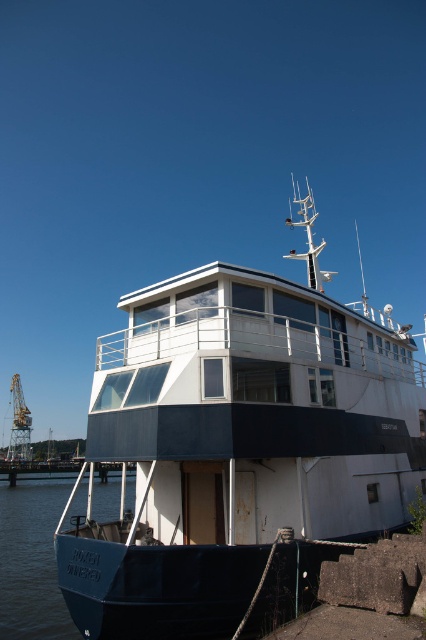
Question: Among these objects, which one is farthest from the camera?

Choices:
 (A) white matte cabin cruiser at center
 (B) teal rubber boat at lower left

Answer: (B)

Question: Is white matte cabin cruiser at center smaller than teal rubber boat at lower left?

Choices:
 (A) no
 (B) yes

Answer: (A)

Question: Is white matte cabin cruiser at center positioned at the back of teal rubber boat at lower left?

Choices:
 (A) yes
 (B) no

Answer: (B)

Question: Is white matte cabin cruiser at center smaller than teal rubber boat at lower left?

Choices:
 (A) yes
 (B) no

Answer: (B)

Question: Which point is farther from the camera taking this photo?

Choices:
 (A) (89, 600)
 (B) (34, 561)

Answer: (B)